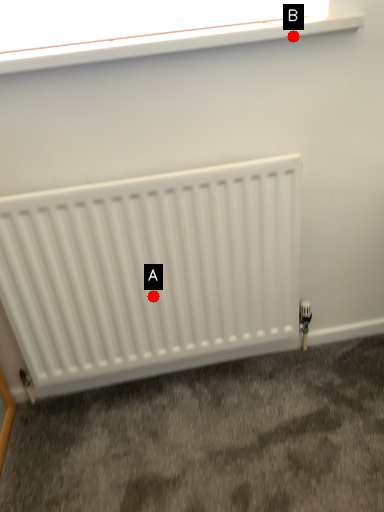
Question: Two points are circled on the image, labeled by A and B beside each circle. Which point appears farthest from the camera in this image?

Choices:
 (A) A is further
 (B) B is further

Answer: (A)